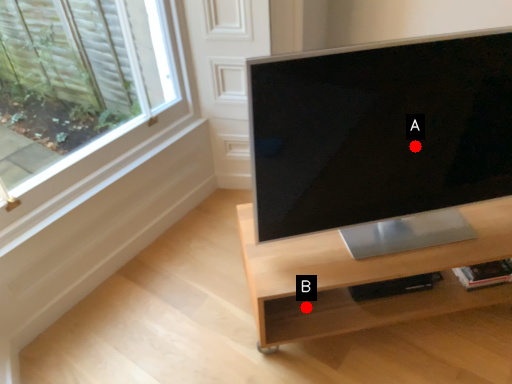
Question: Two points are circled on the image, labeled by A and B beside each circle. Which point appears closest to the camera in this image?

Choices:
 (A) A is closer
 (B) B is closer

Answer: (A)